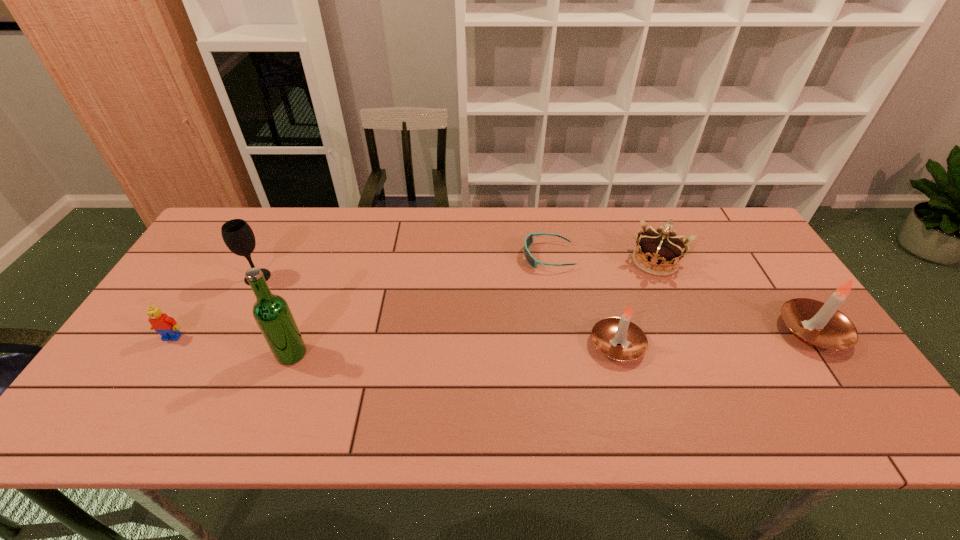
This screenshot has height=540, width=960. Find the location of `free space that satisfies the following two spatial constraints: 1. on the back side of the shorter candle; 2. on the front-facing side of the sunglasses`. free space that satisfies the following two spatial constraints: 1. on the back side of the shorter candle; 2. on the front-facing side of the sunglasses is located at coordinates (592, 256).

You are a GUI agent. You are given a task and a screenshot of the screen. Output one action in this format:
    pyautogui.click(x=<x>, y=<y>)
    Task: Click on the vacant space that satisfies the following two spatial constraints: 1. on the front side of the second object from left to right; 2. on the left side of the shorter candle
    The width and height of the screenshot is (960, 540).
    Given the screenshot: What is the action you would take?
    pyautogui.click(x=223, y=345)

Identify the location of free point that satisfies the following two spatial constraints: 1. on the front-facing side of the shortest object; 2. on the left side of the taller candle. (x=561, y=331).

The height and width of the screenshot is (540, 960). Identify the location of free spot that satisfies the following two spatial constraints: 1. on the face of the leftmost object; 2. on the left side of the beer bottle. (162, 354).

The height and width of the screenshot is (540, 960). I want to click on vacant region that satisfies the following two spatial constraints: 1. on the face of the leftmost object; 2. on the right side of the third object from left to right, so click(x=162, y=354).

The image size is (960, 540). I want to click on vacant area that satisfies the following two spatial constraints: 1. on the front-facing side of the sunglasses; 2. on the face of the Lego, so click(x=562, y=337).

Identify the location of vacant region that satisfies the following two spatial constraints: 1. on the front side of the wineglass; 2. on the left side of the rightmost object. This screenshot has height=540, width=960. pos(229,331).

This screenshot has width=960, height=540. I want to click on vacant space that satisfies the following two spatial constraints: 1. on the back side of the fourth tallest object; 2. on the left side of the second object from right to left, so pos(594,261).

Identify the location of blank space that satisfies the following two spatial constraints: 1. on the face of the tallest object; 2. on the right side of the Lego. (162, 354).